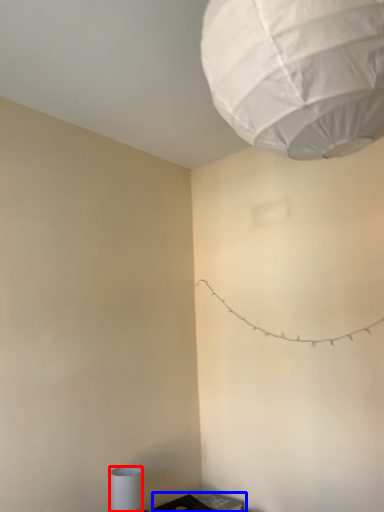
Question: Which of the following is the farthest to the observer, lamp (highlighted by a red box) or furniture (highlighted by a blue box)?

Choices:
 (A) lamp
 (B) furniture

Answer: (B)